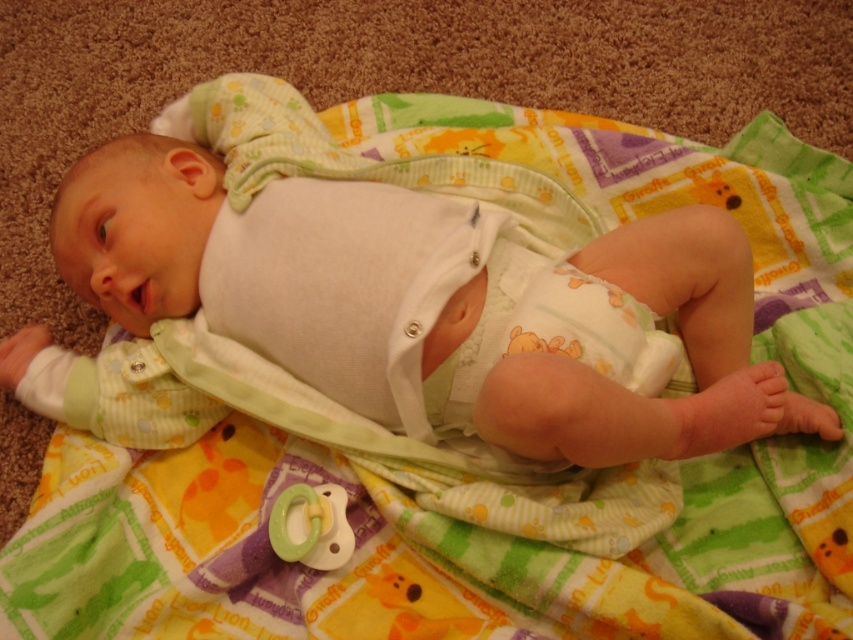
Is white cotton baby at center wider than green rubber pacifier at center?

Yes, white cotton baby at center is wider than green rubber pacifier at center.

Can you confirm if white cotton baby at center is positioned above green rubber pacifier at center?

Correct, white cotton baby at center is located above green rubber pacifier at center.

Find the location of a particular element. This screenshot has height=640, width=853. white cotton baby at center is located at coordinates (264, 264).

Is white soft diaper at center bigger than green rubber pacifier at center?

Yes, white soft diaper at center is bigger than green rubber pacifier at center.

Is point (492, 326) closer to camera compared to point (315, 529)?

No.

Where is `white soft diaper at center`? white soft diaper at center is located at coordinates (546, 336).

Which is more to the right, white cotton baby at center or white soft diaper at center?

Positioned to the right is white soft diaper at center.

Can you confirm if white cotton baby at center is positioned below white soft diaper at center?

No.

The height and width of the screenshot is (640, 853). Describe the element at coordinates (264, 264) in the screenshot. I see `white cotton baby at center` at that location.

This screenshot has width=853, height=640. I want to click on white cotton baby at center, so click(x=264, y=264).